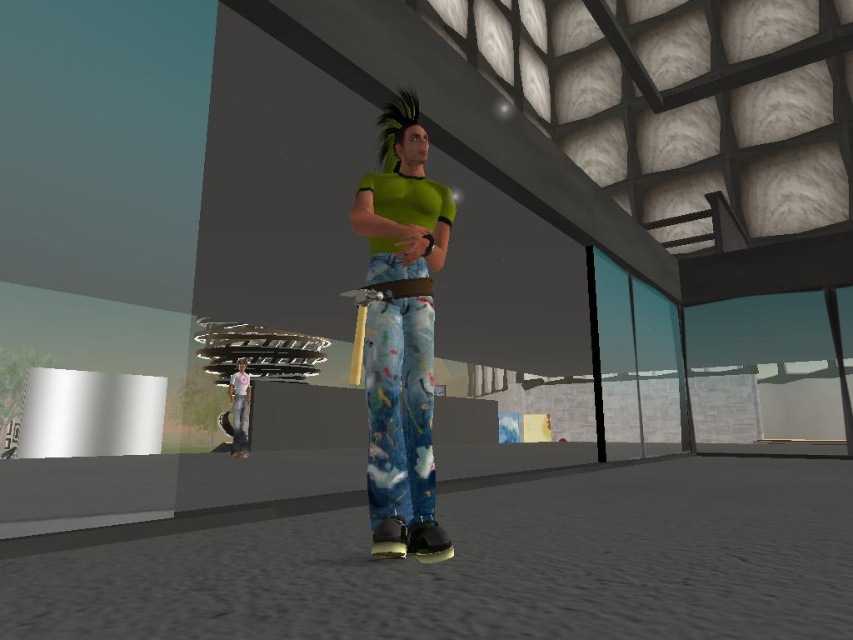
You are a fashion designer observing a model in a virtual fitting room. The model is wearing the green spiky hair at center and the light blue denim pants at lower left. Which item of clothing is shorter in height?

The green spiky hair at center is shorter than the light blue denim pants at lower left.

Looking at this image, you are a character in the virtual environment and need to move from the light blue denim pants at lower left to the painted denim pants at center. In which direction should you move?

You should move to the right to reach the painted denim pants at center from the light blue denim pants at lower left since the painted denim pants at center is positioned to the right of the light blue denim pants at lower left.